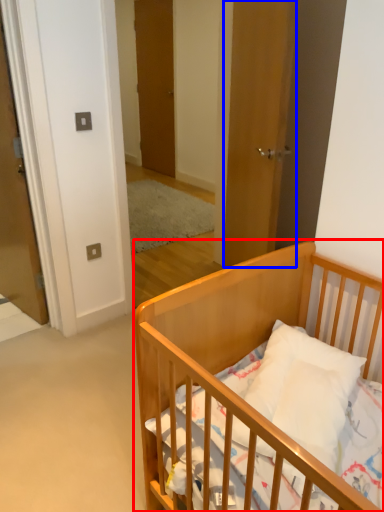
Question: Which point is further to the camera, infant bed (highlighted by a red box) or door (highlighted by a blue box)?

Choices:
 (A) infant bed
 (B) door

Answer: (B)